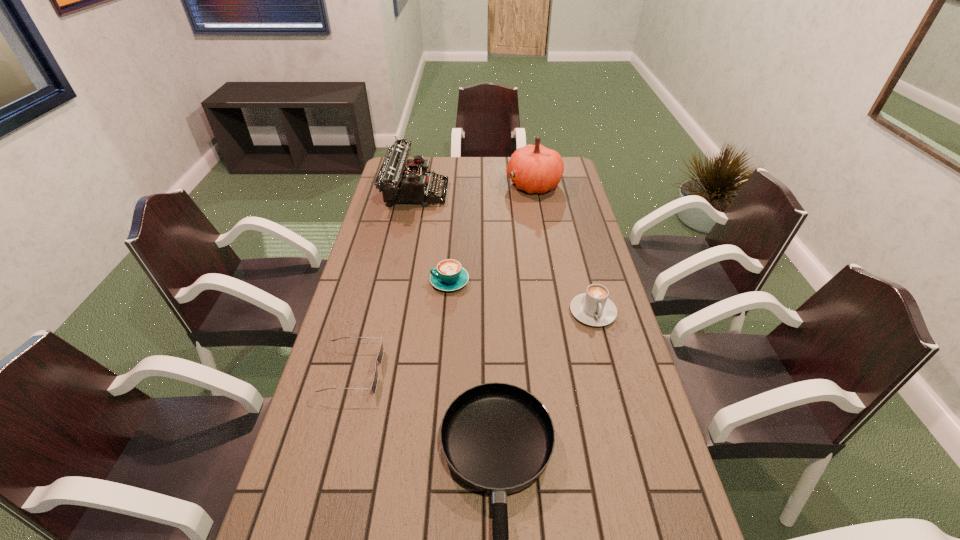
Locate an element on the screen. pumpkin is located at coordinates (537, 169).

You are a GUI agent. You are given a task and a screenshot of the screen. Output one action in this format:
    pyautogui.click(x=<x>, y=<y>)
    Task: Click on the second tallest object
    This screenshot has height=540, width=960.
    Given the screenshot: What is the action you would take?
    pyautogui.click(x=399, y=183)

Where is `the fourth shortest object`? the fourth shortest object is located at coordinates (593, 308).

Find the location of `the taller cappuccino`. the taller cappuccino is located at coordinates (593, 308).

At what (x,y) coordinates should I click in order to perform the action: click on the left cappuccino. Please return your answer as a coordinate pair (x, y). This screenshot has height=540, width=960. Looking at the image, I should click on (449, 275).

The image size is (960, 540). In order to click on the farther cappuccino in this screenshot , I will do `click(449, 275)`.

Locate an element on the screen. The height and width of the screenshot is (540, 960). the shortest object is located at coordinates (380, 356).

Where is `free location located 0.240m on the front-facing side of the tallest object`? Image resolution: width=960 pixels, height=540 pixels. free location located 0.240m on the front-facing side of the tallest object is located at coordinates (450, 184).

Identify the location of free region located on the front-facing side of the tallest object. (x=432, y=184).

Find the location of a particular element. vacant space located on the front-facing side of the tallest object is located at coordinates (450, 184).